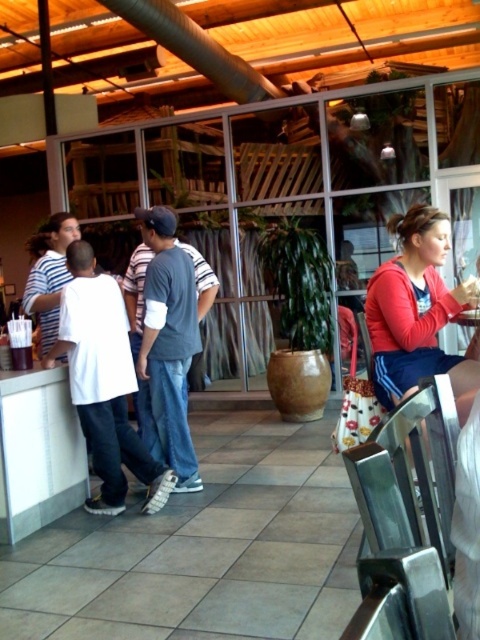
Is point (444, 369) positioned behind point (163, 339)?

No, (444, 369) is in front of (163, 339).

What do you see at coordinates (418, 314) in the screenshot? I see `red fleece jacket at right` at bounding box center [418, 314].

At what (x,y) coordinates should I click in order to perform the action: click on red fleece jacket at right. Please return your answer as a coordinate pair (x, y). This screenshot has height=640, width=480. Looking at the image, I should click on (418, 314).

Is white matte shirt at left to the left of gray cotton shirt at center from the viewer's perspective?

Yes, white matte shirt at left is to the left of gray cotton shirt at center.

Based on the photo, can you confirm if white matte shirt at left is positioned to the right of gray cotton shirt at center?

Incorrect, white matte shirt at left is not on the right side of gray cotton shirt at center.

The width and height of the screenshot is (480, 640). I want to click on white matte shirt at left, so click(104, 384).

The width and height of the screenshot is (480, 640). In order to click on white matte shirt at left in this screenshot , I will do `click(104, 384)`.

Does white matte shirt at left have a greater width compared to red fleece jacket at right?

Correct, the width of white matte shirt at left exceeds that of red fleece jacket at right.

Is point (120, 304) less distant than point (397, 298)?

No, it is not.

Who is more distant from viewer, (x=109, y=356) or (x=427, y=332)?

Positioned behind is point (x=109, y=356).

What are the coordinates of `white matte shirt at left` in the screenshot? It's located at (104, 384).